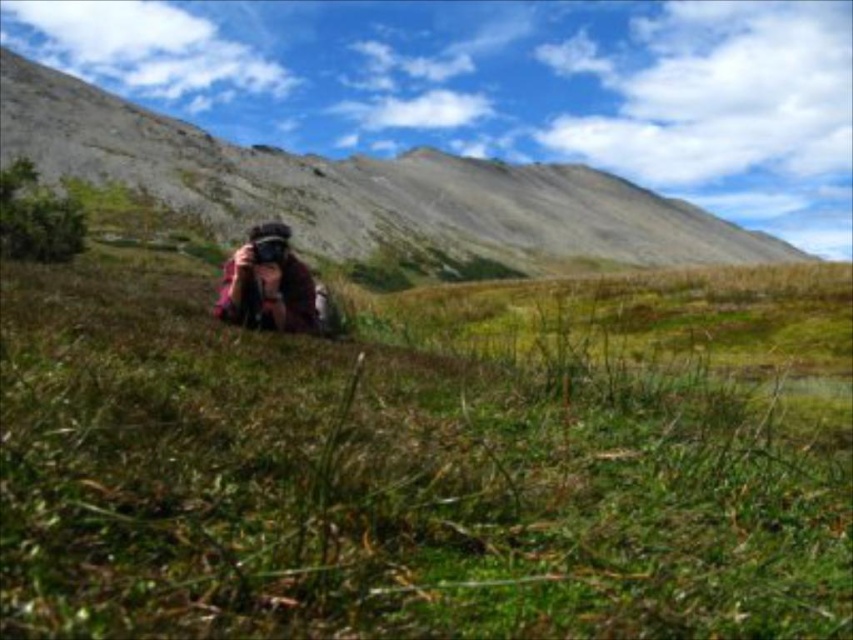
Question: Which object appears farthest from the camera in this image?

Choices:
 (A) smooth gray rock at center
 (B) matte black camera at center

Answer: (A)

Question: Does smooth gray rock at center have a greater width compared to matte black camera at center?

Choices:
 (A) no
 (B) yes

Answer: (B)

Question: Is smooth gray rock at center bigger than matte black camera at center?

Choices:
 (A) yes
 (B) no

Answer: (A)

Question: Can you confirm if smooth gray rock at center is thinner than matte black camera at center?

Choices:
 (A) yes
 (B) no

Answer: (B)

Question: Which object appears closest to the camera in this image?

Choices:
 (A) matte black camera at center
 (B) smooth gray rock at center

Answer: (A)

Question: Which point appears farthest from the camera in this image?

Choices:
 (A) (216, 205)
 (B) (271, 288)

Answer: (A)